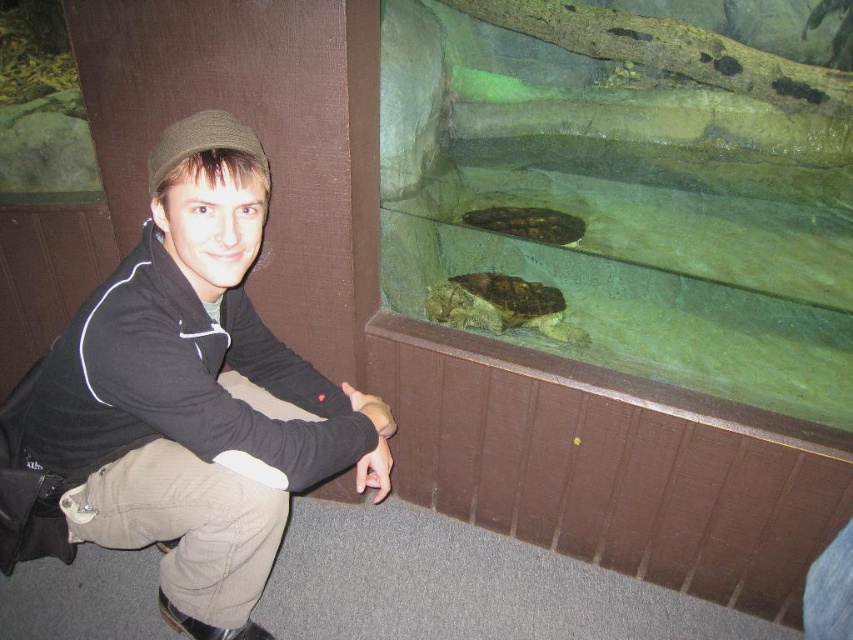
You are a tour guide explaining the aquarium to a visitor. The visitor asks, while pointing at the black matte jacket at lower left and the brown matte turtle at upper center, which one is positioned more to the left? Please answer based on their positions in the image.

The black matte jacket at lower left is positioned more to the left than the brown matte turtle at upper center.

You are a photographer trying to capture a clear shot of the brown matte turtle at upper center without the black matte jacket at lower left blocking the view. Based on their heights, can you position yourself so the turtle is fully visible above the jacket?

The black matte jacket at lower left is taller than the brown matte turtle at upper center, so positioning yourself to see the turtle fully above the jacket may be challenging as the jacket is taller and could obstruct the view.